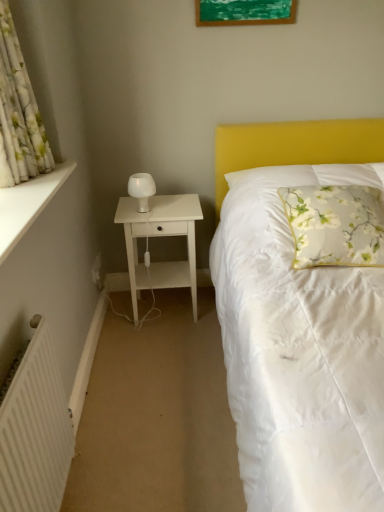
Locate an element on the screen. The image size is (384, 512). free spot to the right of white frosted glass lamp at left is located at coordinates (180, 206).